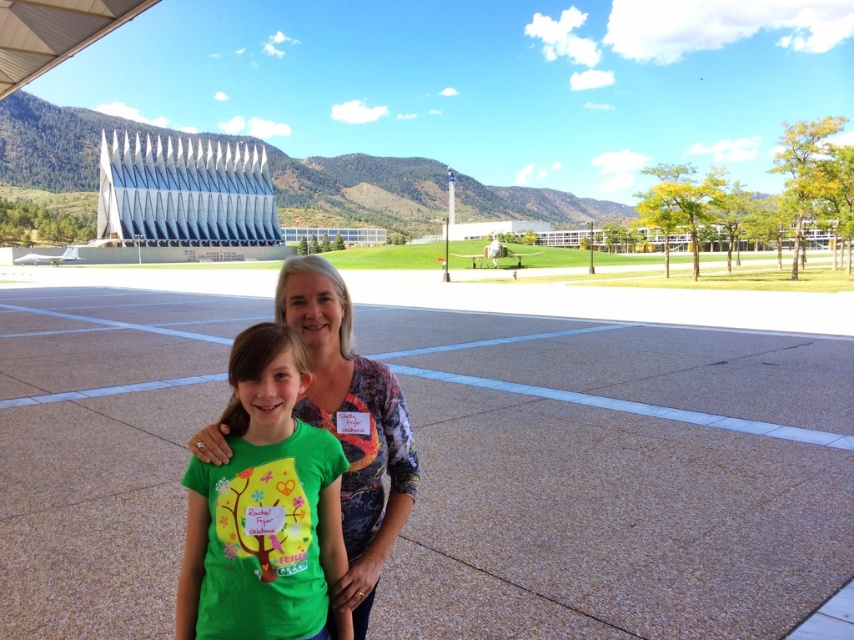
Question: Is green concrete football field at center positioned behind green matte shirt at center?

Choices:
 (A) yes
 (B) no

Answer: (A)

Question: Can you confirm if green concrete football field at center is thinner than green matte shirt at center?

Choices:
 (A) yes
 (B) no

Answer: (B)

Question: Can you confirm if green concrete football field at center is positioned to the left of green matte shirt at center?

Choices:
 (A) yes
 (B) no

Answer: (A)